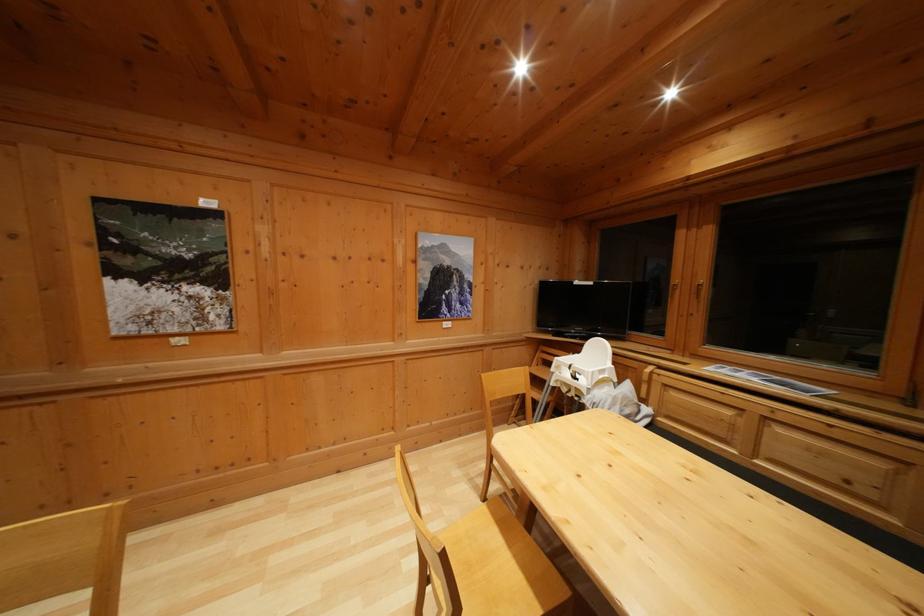
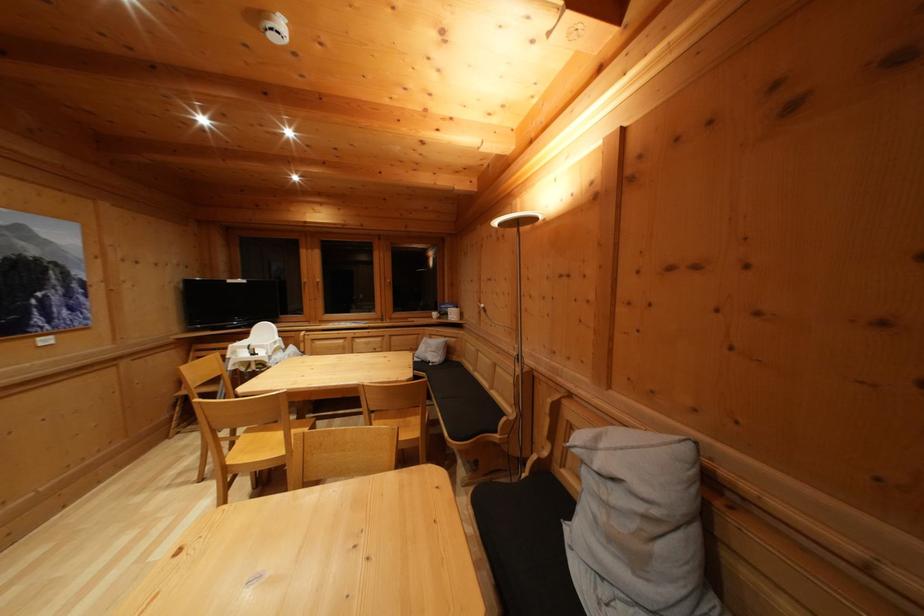
The point at (681, 288) is marked in the first image. Where is the corresponding point in the second image?

(310, 286)